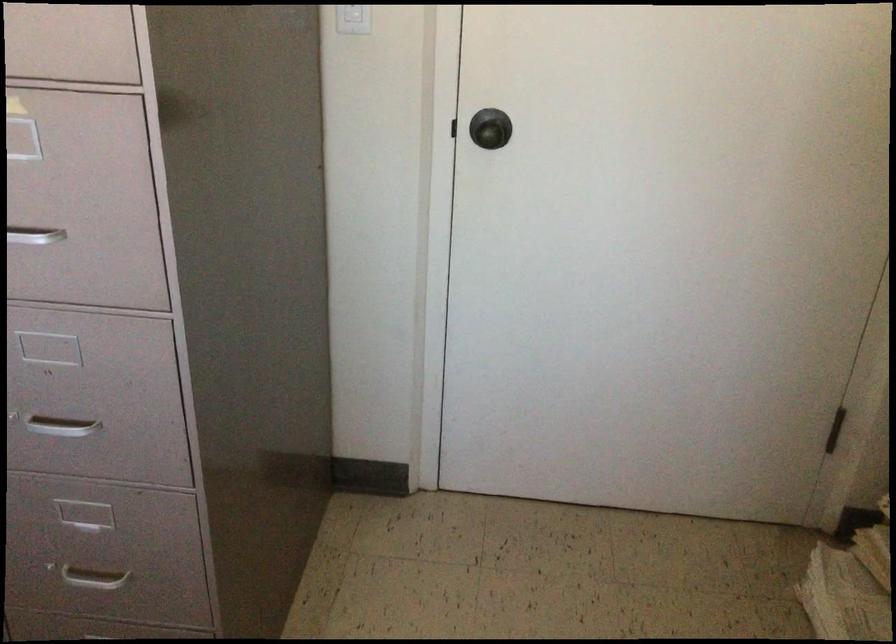
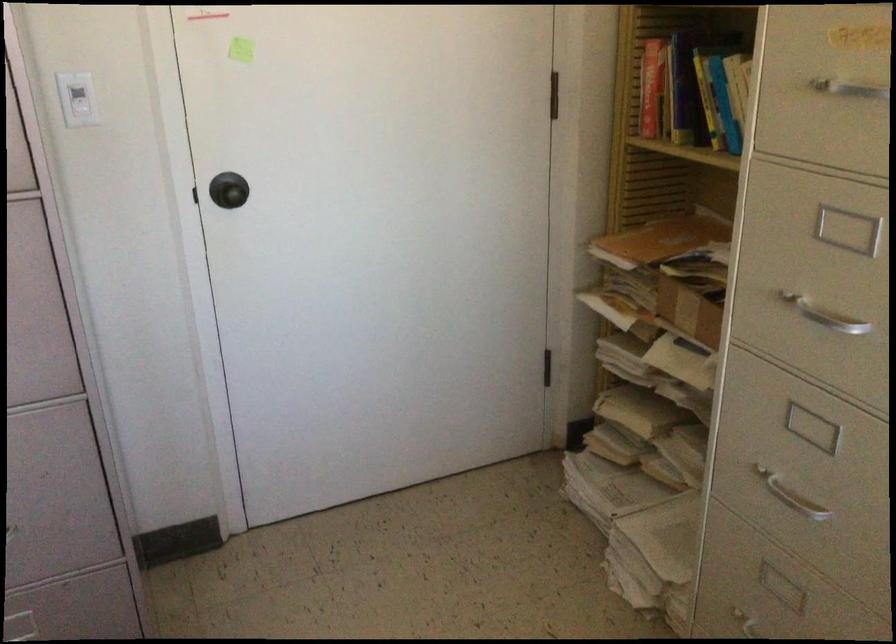
Locate, in the second image, the point that corresponds to [494,131] in the first image.

(228, 190)